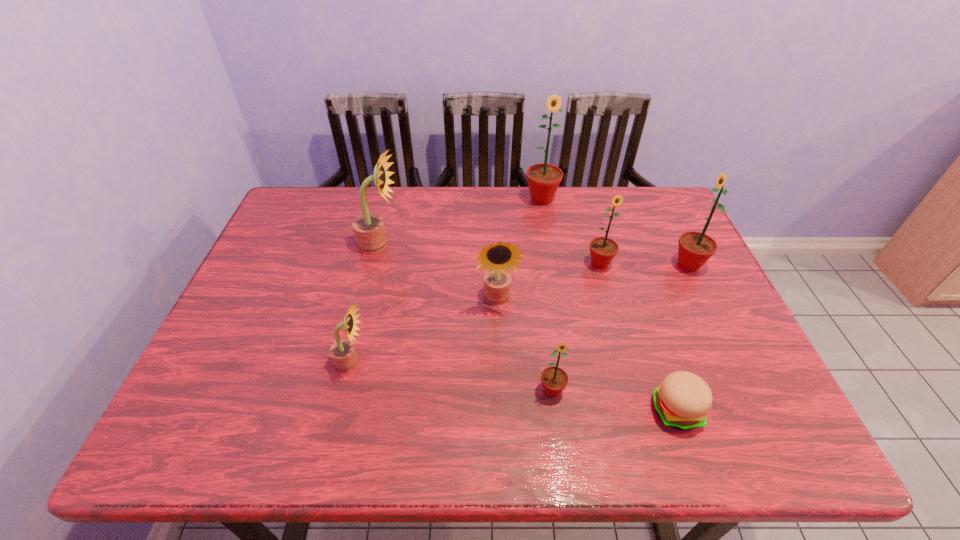
Identify the location of the nearest yellow sunflower. pyautogui.click(x=342, y=352).

You are a GUI agent. You are given a task and a screenshot of the screen. Output one action in this format:
    pyautogui.click(x=<x>, y=<y>)
    Task: Click on the nearest green sunflower
    This screenshot has width=960, height=540.
    Given the screenshot: What is the action you would take?
    pyautogui.click(x=554, y=379)

The image size is (960, 540). What are the coordinates of `the smallest green sunflower` in the screenshot? It's located at (554, 379).

This screenshot has height=540, width=960. I want to click on beige hamburger, so tap(683, 399).

At what (x,y) coordinates should I click in order to perform the action: click on hamburger. Please return your answer as a coordinate pair (x, y). The height and width of the screenshot is (540, 960). Looking at the image, I should click on (683, 399).

The image size is (960, 540). Identify the location of vacant space positioned 0.320m on the face of the tallest object. (555, 280).

Identify the location of vacant space situated on the face of the farthest yellow sunflower. The height and width of the screenshot is (540, 960). (475, 244).

Locate an element on the screen. vacant space positioned on the face of the rightmost object is located at coordinates (568, 265).

I want to click on free space located 0.140m on the face of the rightmost object, so click(x=621, y=265).

Where is `vacant space located on the face of the rightmost object`? This screenshot has width=960, height=540. vacant space located on the face of the rightmost object is located at coordinates (593, 265).